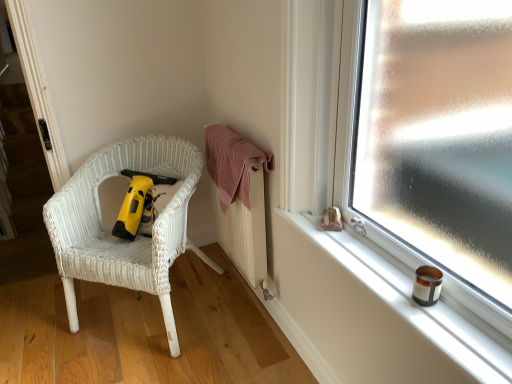
You are a GUI agent. You are given a task and a screenshot of the screen. Output one action in this format:
    pyautogui.click(x=<x>, y=<y>)
    Task: Click on the vacant space to the left of white wicker chair at left
    
    Given the screenshot: What is the action you would take?
    pyautogui.click(x=37, y=326)